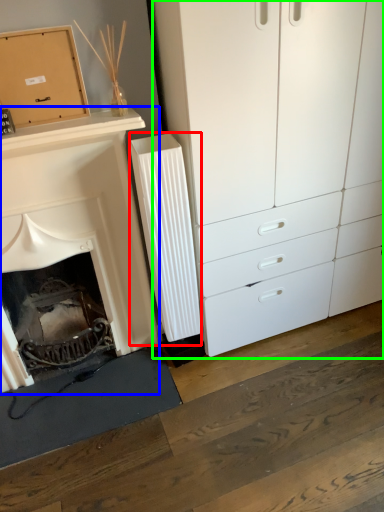
Question: Which is farther away from radiator (highlighted by a red box)? fireplace (highlighted by a blue box) or chest of drawers (highlighted by a green box)?

Choices:
 (A) fireplace
 (B) chest of drawers

Answer: (B)